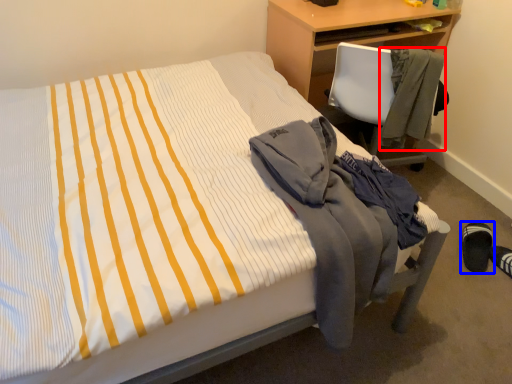
Question: Among these objects, which one is farthest to the camera, jacket (highlighted by a red box) or footwear (highlighted by a blue box)?

Choices:
 (A) jacket
 (B) footwear

Answer: (B)